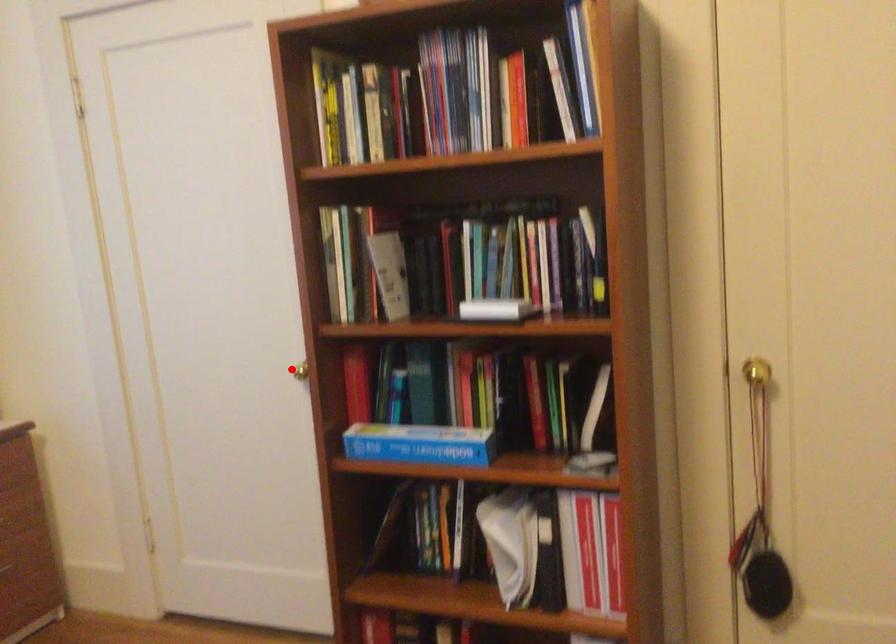
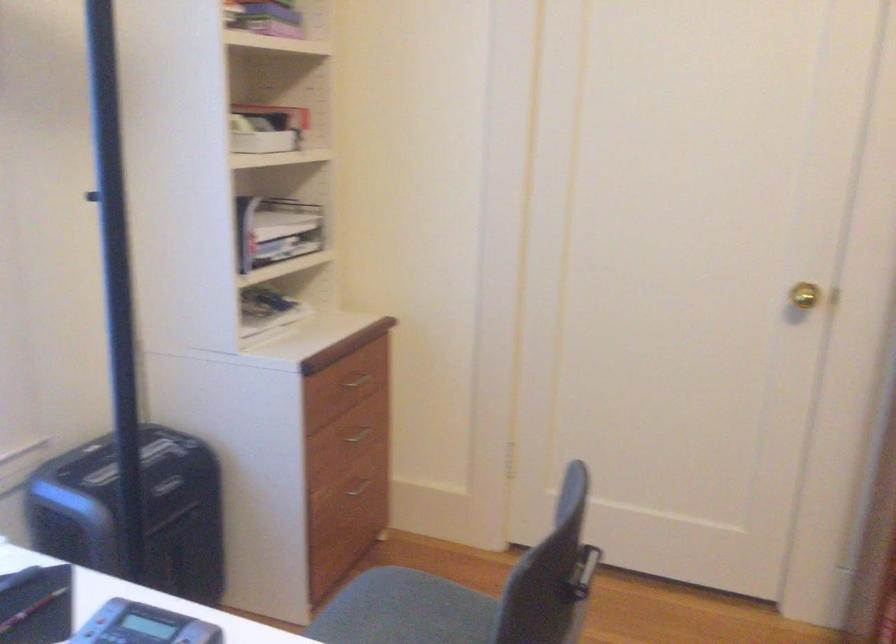
In the second image, find the point that corresponds to the highlighted location in the first image.

(804, 295)